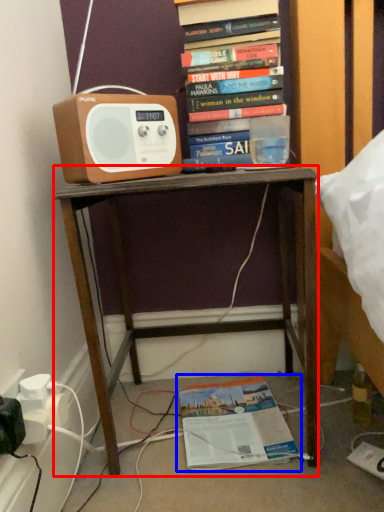
Question: Which point is closer to the camera, desk (highlighted by a red box) or book (highlighted by a blue box)?

Choices:
 (A) desk
 (B) book

Answer: (A)